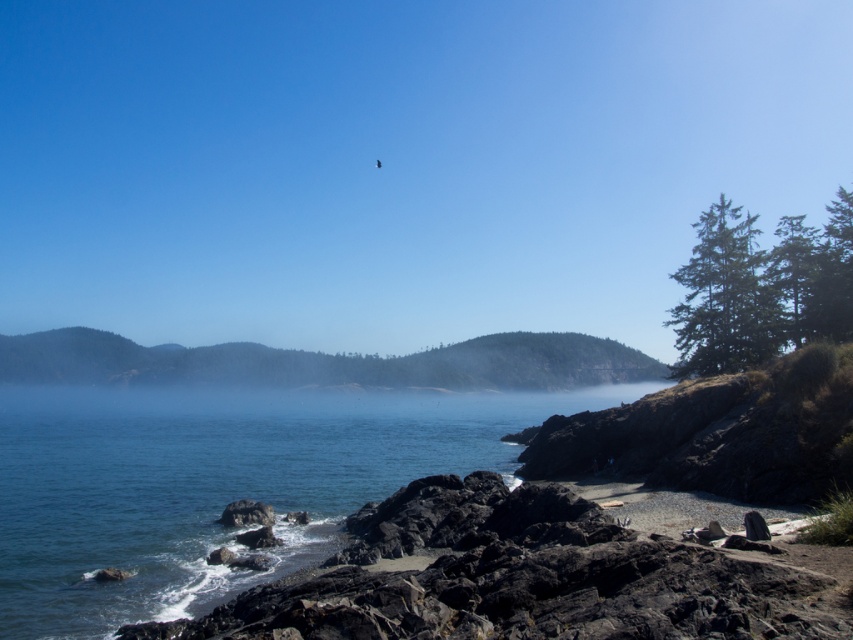
You are standing on the beach and want to reach the clear blue water at center. Which direction should you head towards?

You should head towards the center of the image to reach the clear blue water at center, as it is located at point coordinates of (215, 483).

You are planning to build a small boat dock. You need to choose between placing it in the clear blue water at center or on the volcanic rock beach at lower right. Which location has a wider area for the dock?

The clear blue water at center has a wider area than the volcanic rock beach at lower right, so it is suitable for placing the dock.